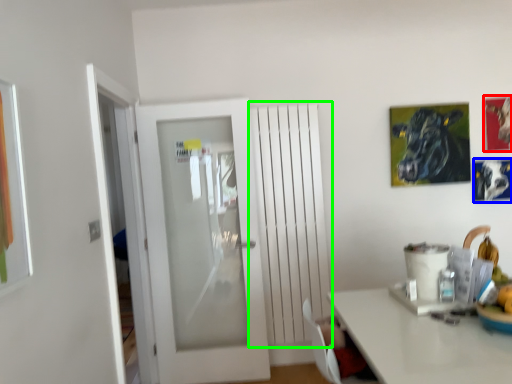
Question: Which object is the farthest from picture frame (highlighted by a red box)? Choose among these: picture frame (highlighted by a blue box) or radiator (highlighted by a green box).

Choices:
 (A) picture frame
 (B) radiator

Answer: (B)